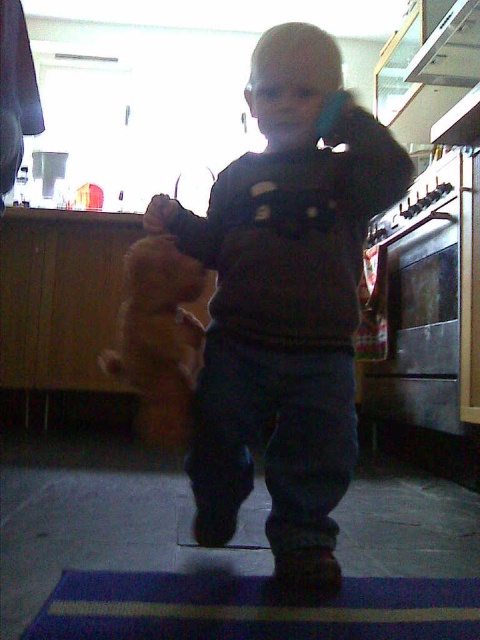
You are a delivery robot that needs to place a package on the blue striped rug at lower center. You are currently positioned near the white glossy exhaust hood at upper right. What is the shortest distance you need to travel to reach the rug?

The blue striped rug at lower center is 1.76 meters away from the white glossy exhaust hood at upper right, so the shortest distance the robot needs to travel is 1.76 meters.

You are a delivery robot that is 1.2 meters tall. You need to deliver a package to the kitchen counter near the white glossy exhaust hood at upper right. The package is currently on the dark gray sweater at center. Can you reach the package without bending down?

The distance between the dark gray sweater at center and the white glossy exhaust hood at upper right is 1.32 meters. Since the robot is 1.2 meters tall, it can reach the package on the dark gray sweater at center as it is slightly lower than the robot height.

You are a parent trying to clean up the kitchen. You see the blue striped rug at lower center and the white glossy exhaust hood at upper right. Which object is closer to the left side of the kitchen?

The blue striped rug at lower center is positioned on the left side of the white glossy exhaust hood at upper right, so it is closer to the left side of the kitchen.